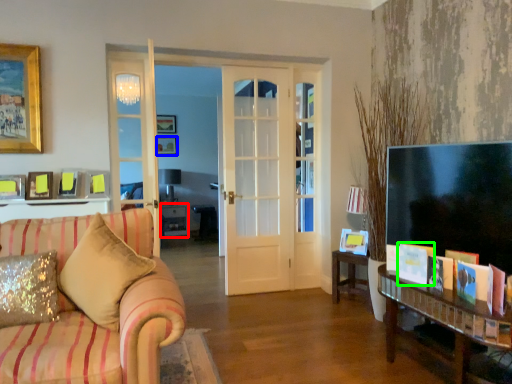
Question: Which object is positioned farthest from table (highlighted by a red box)? Select from picture frame (highlighted by a blue box) and book (highlighted by a green box).

Choices:
 (A) picture frame
 (B) book

Answer: (B)